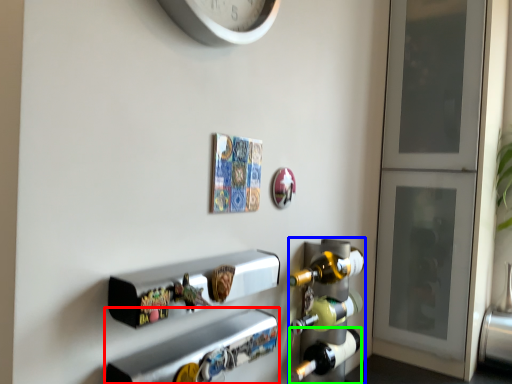
Question: Estimate the real-world distances between objects in this image. Which object is farther from shelf (highlighted by a red box), wine rack (highlighted by a blue box) or beer bottle (highlighted by a green box)?

Choices:
 (A) wine rack
 (B) beer bottle

Answer: (B)